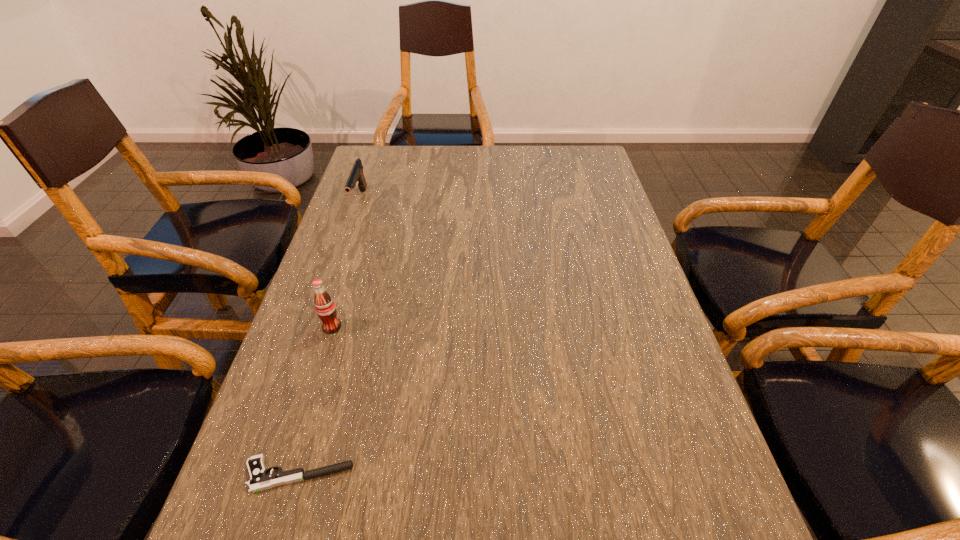
Where is `the tallest object`? Image resolution: width=960 pixels, height=540 pixels. the tallest object is located at coordinates (325, 307).

At what (x,y) coordinates should I click in order to perform the action: click on the second farthest object. Please return your answer as a coordinate pair (x, y). The height and width of the screenshot is (540, 960). Looking at the image, I should click on (325, 307).

In order to click on the taller pistol in this screenshot , I will do `click(356, 175)`.

Locate an element on the screen. the farthest object is located at coordinates (356, 175).

Find the location of a particular element. This screenshot has height=540, width=960. the shorter pistol is located at coordinates click(x=259, y=480).

You are a GUI agent. You are given a task and a screenshot of the screen. Output one action in this format:
    pyautogui.click(x=<x>, y=<y>)
    Task: Click on the nearer pistol
    This screenshot has width=960, height=540.
    Given the screenshot: What is the action you would take?
    point(259,480)

The height and width of the screenshot is (540, 960). In order to click on vacant area located 0.240m on the right of the second farthest object in this screenshot , I will do `click(452, 327)`.

At what (x,y) coordinates should I click in order to perform the action: click on vacant position located at the muzzle of the second tallest object. Please return your answer as a coordinate pair (x, y). The width and height of the screenshot is (960, 540). Looking at the image, I should click on (336, 271).

At what (x,y) coordinates should I click in order to perform the action: click on soda at the left edge. Please return your answer as a coordinate pair (x, y). This screenshot has width=960, height=540. Looking at the image, I should click on (325, 307).

The width and height of the screenshot is (960, 540). In the image, there is a desktop. What are the coordinates of `vacant space at the far edge` in the screenshot? It's located at (447, 167).